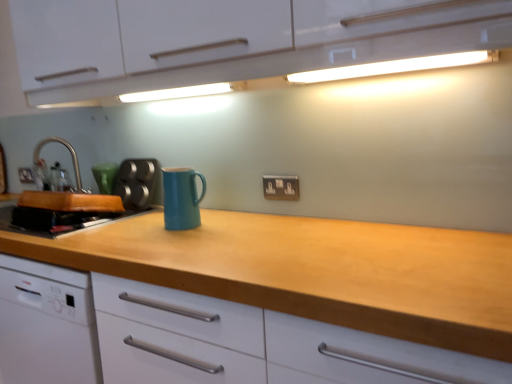
Question: Considering the relative sizes of matte silver electric outlet at center and wooden cutting board at left, which ranks as the 1th kitchen appliance in left-to-right order, in the image provided, is matte silver electric outlet at center taller than wooden cutting board at left, which ranks as the 1th kitchen appliance in left-to-right order,?

Choices:
 (A) no
 (B) yes

Answer: (A)

Question: Is wooden cutting board at left, which ranks as the 2th kitchen appliance in right-to-left order, completely or partially inside matte silver electric outlet at center?

Choices:
 (A) no
 (B) yes

Answer: (A)

Question: From the image's perspective, is matte silver electric outlet at center below wooden cutting board at left, the first kitchen appliance positioned from the back?

Choices:
 (A) no
 (B) yes

Answer: (A)

Question: Is matte silver electric outlet at center outside wooden cutting board at left, which ranks as the 1th kitchen appliance in left-to-right order?

Choices:
 (A) no
 (B) yes

Answer: (B)

Question: From the image's perspective, would you say matte silver electric outlet at center is positioned over wooden cutting board at left, which ranks as the 1th kitchen appliance in left-to-right order?

Choices:
 (A) no
 (B) yes

Answer: (B)

Question: From a real-world perspective, is wooden at center physically located above or below brushed metal tap at left?

Choices:
 (A) above
 (B) below

Answer: (B)

Question: Is point (468, 264) positioned closer to the camera than point (74, 167)?

Choices:
 (A) farther
 (B) closer

Answer: (B)

Question: In terms of size, does wooden at center appear bigger or smaller than brushed metal tap at left?

Choices:
 (A) small
 (B) big

Answer: (B)

Question: Is wooden at center inside the boundaries of brushed metal tap at left, or outside?

Choices:
 (A) inside
 (B) outside

Answer: (B)

Question: Is white glossy cabinet at upper center in front of or behind teal matte mug at center, which is the 1th kitchen appliance in front-to-back order, in the image?

Choices:
 (A) front
 (B) behind

Answer: (A)

Question: From the image's perspective, is white glossy cabinet at upper center positioned above or below teal matte mug at center, which is the 1th kitchen appliance in front-to-back order?

Choices:
 (A) below
 (B) above

Answer: (B)

Question: In the image, is white glossy cabinet at upper center on the left side or the right side of teal matte mug at center, which ranks as the second kitchen appliance in back-to-front order?

Choices:
 (A) left
 (B) right

Answer: (B)

Question: Is white glossy cabinet at upper center bigger or smaller than teal matte mug at center, the second kitchen appliance in the left-to-right sequence?

Choices:
 (A) big
 (B) small

Answer: (A)

Question: Relative to matte silver electric outlet at center, is metallic silver muffin tin at left in front or behind?

Choices:
 (A) front
 (B) behind

Answer: (B)

Question: Is metallic silver muffin tin at left wider or thinner than matte silver electric outlet at center?

Choices:
 (A) wide
 (B) thin

Answer: (A)